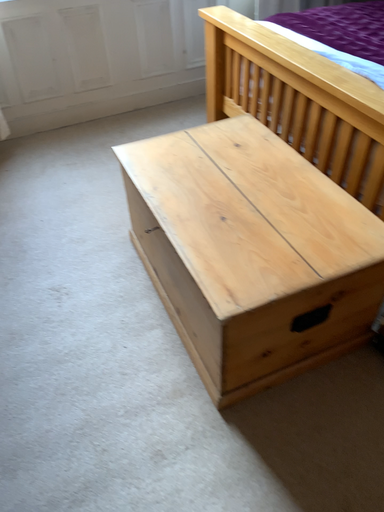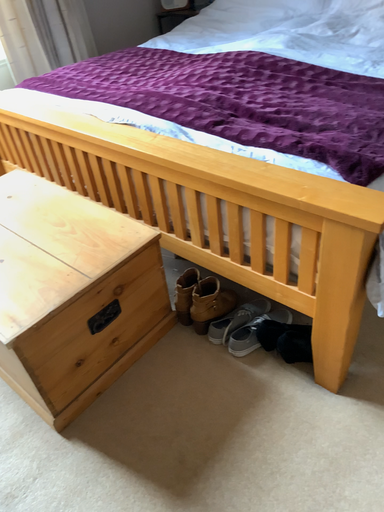
Question: Which way did the camera rotate in the video?

Choices:
 (A) rotated right
 (B) rotated left

Answer: (A)